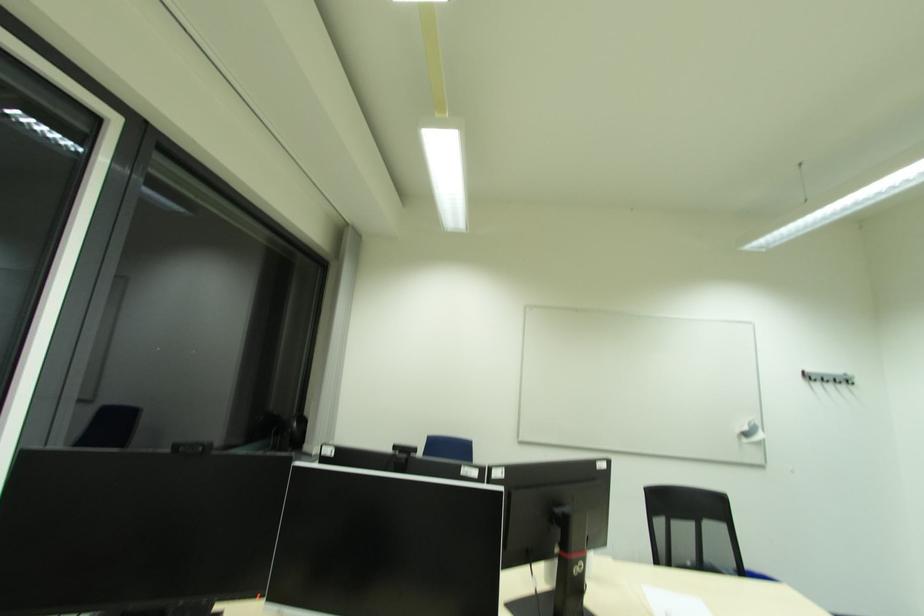
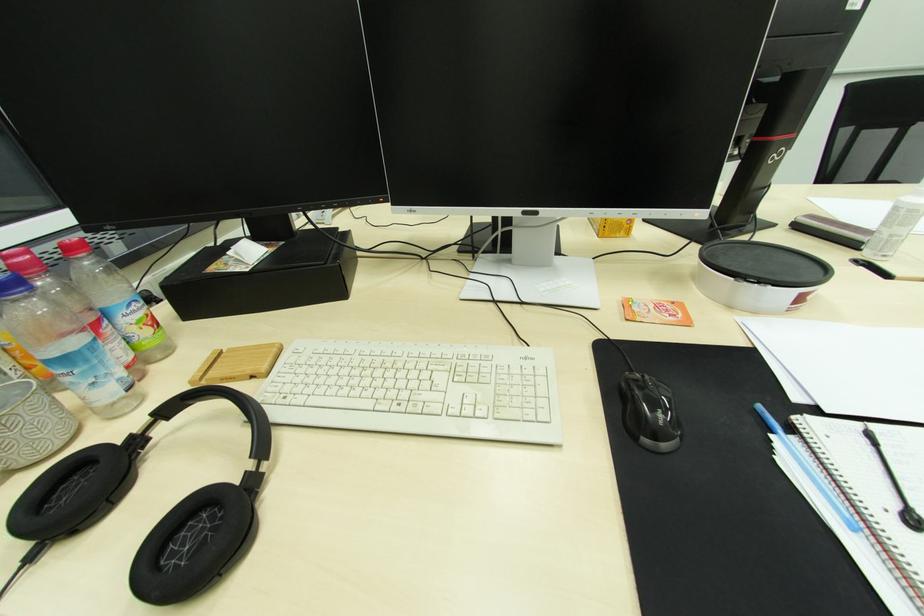
Question: The first image is from the beginning of the video and the second image is from the end. How did the camera likely rotate when shooting the video?

Choices:
 (A) Left
 (B) Right
 (C) Up
 (D) Down

Answer: (D)